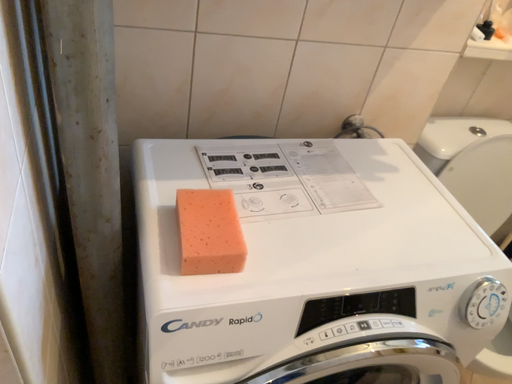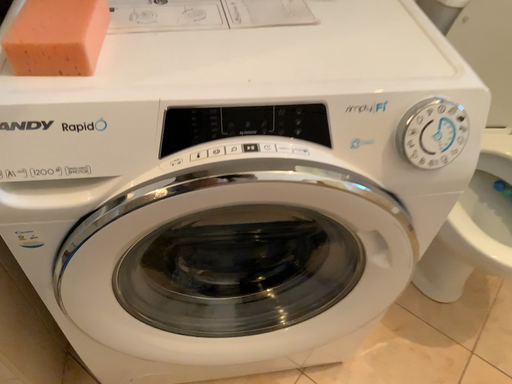
Question: How did the camera likely rotate when shooting the video?

Choices:
 (A) rotated upward
 (B) rotated downward

Answer: (B)